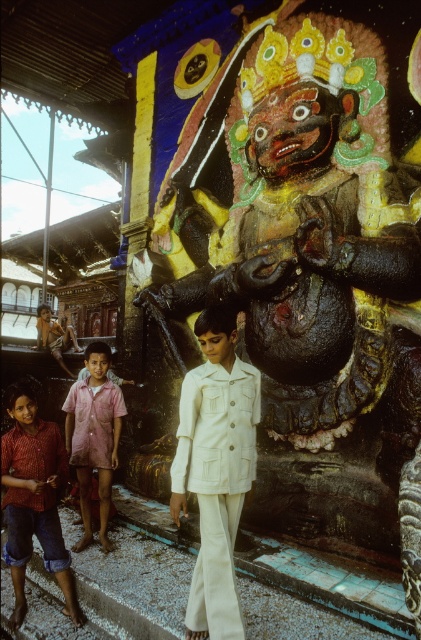
You are standing in front of the statue of the deity and want to touch the point at coordinates (306, 256). Is this point on the polished bronze statue at center?

Yes, the point at coordinates (306, 256) is on the polished bronze statue at center.

You are a photographer trying to capture a group photo of the children near the deity statue. You need to position yourself so that you can see both the red plaid shirt at lower left and the pink cotton shirt at center in your frame. Based on their positions, which direction should you face to ensure both are visible?

To capture both the red plaid shirt at lower left and the pink cotton shirt at center in your frame, you should face towards the center area where the pink cotton shirt is positioned. Since the red plaid shirt at lower left is to the left of the pink cotton shirt at center, positioning yourself facing the center will allow both children to be included in the shot.